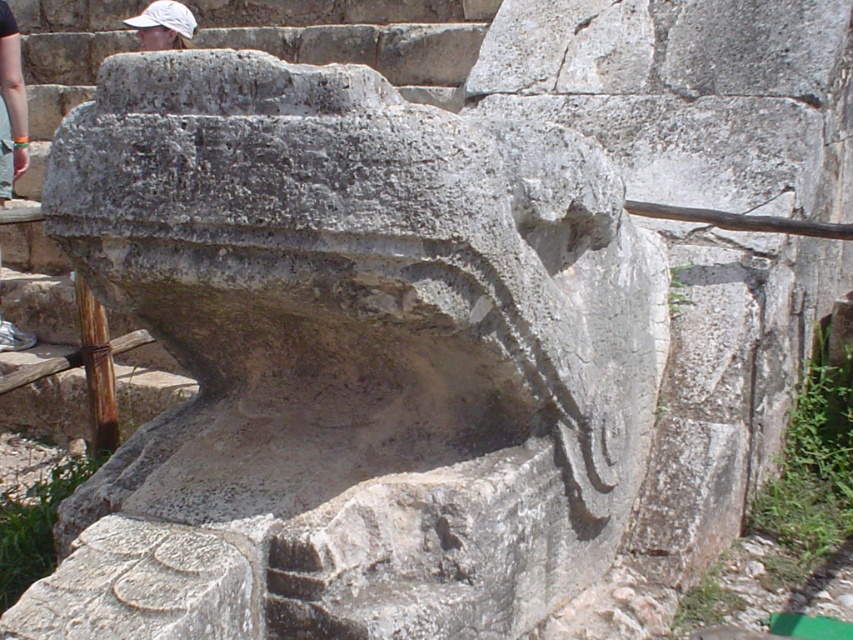
Does gray stone carving at center have a greater width compared to white matte baseball cap at upper left?

Indeed, gray stone carving at center has a greater width compared to white matte baseball cap at upper left.

Describe the element at coordinates (347, 358) in the screenshot. This screenshot has width=853, height=640. I see `gray stone carving at center` at that location.

Which is in front, point (368, 252) or point (184, 8)?

Positioned in front is point (368, 252).

The width and height of the screenshot is (853, 640). Find the location of `gray stone carving at center`. gray stone carving at center is located at coordinates 347,358.

How much distance is there between gray stone carving at center and white fabric at upper left?

They are 3.59 meters apart.

Which is in front, point (219, 403) or point (9, 140)?

Point (219, 403) is in front.

Which is behind, point (421, 301) or point (0, 202)?

The point (0, 202) is more distant.

This screenshot has width=853, height=640. In order to click on gray stone carving at center in this screenshot , I will do `click(347, 358)`.

How far apart are white fabric at upper left and white matte baseball cap at upper left?

They are 24.46 inches apart.

Between white fabric at upper left and white matte baseball cap at upper left, which one has more height?

white fabric at upper left

Who is more forward, (9, 323) or (148, 22)?

Point (9, 323) is more forward.

Identify the location of white fabric at upper left. (10, 106).